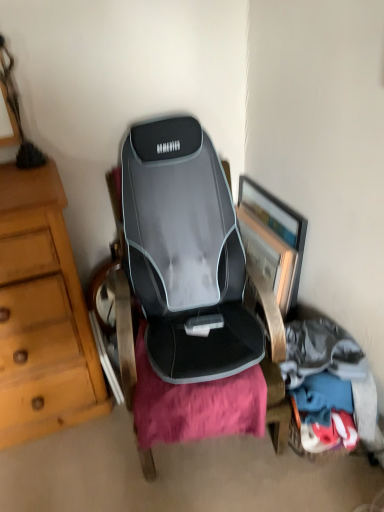
Question: Does soft cotton clothes at lower right have a smaller size compared to wooden framed picture at center right?

Choices:
 (A) yes
 (B) no

Answer: (B)

Question: Is soft cotton clothes at lower right at the left side of wooden framed picture at center right?

Choices:
 (A) yes
 (B) no

Answer: (B)

Question: From the image's perspective, does soft cotton clothes at lower right appear higher than wooden framed picture at center right?

Choices:
 (A) no
 (B) yes

Answer: (A)

Question: Considering the relative sizes of soft cotton clothes at lower right and wooden framed picture at center right in the image provided, is soft cotton clothes at lower right thinner than wooden framed picture at center right?

Choices:
 (A) yes
 (B) no

Answer: (A)

Question: From the image's perspective, is soft cotton clothes at lower right located beneath wooden framed picture at center right?

Choices:
 (A) yes
 (B) no

Answer: (A)

Question: Is soft cotton clothes at lower right positioned with its back to wooden framed picture at center right?

Choices:
 (A) yes
 (B) no

Answer: (A)

Question: Is wooden framed picture at center right surrounding soft cotton clothes at lower right?

Choices:
 (A) yes
 (B) no

Answer: (B)

Question: From the image's perspective, is wooden framed picture at center right under soft cotton clothes at lower right?

Choices:
 (A) yes
 (B) no

Answer: (B)

Question: Can you confirm if wooden framed picture at center right is shorter than soft cotton clothes at lower right?

Choices:
 (A) yes
 (B) no

Answer: (B)

Question: Is wooden framed picture at center right closer to the viewer compared to soft cotton clothes at lower right?

Choices:
 (A) yes
 (B) no

Answer: (B)

Question: From a real-world perspective, is wooden framed picture at center right below soft cotton clothes at lower right?

Choices:
 (A) yes
 (B) no

Answer: (B)

Question: Could you tell me if wooden framed picture at center right is facing soft cotton clothes at lower right?

Choices:
 (A) yes
 (B) no

Answer: (B)

Question: Is point (311, 417) positioned closer to the camera than point (269, 259)?

Choices:
 (A) farther
 (B) closer

Answer: (B)